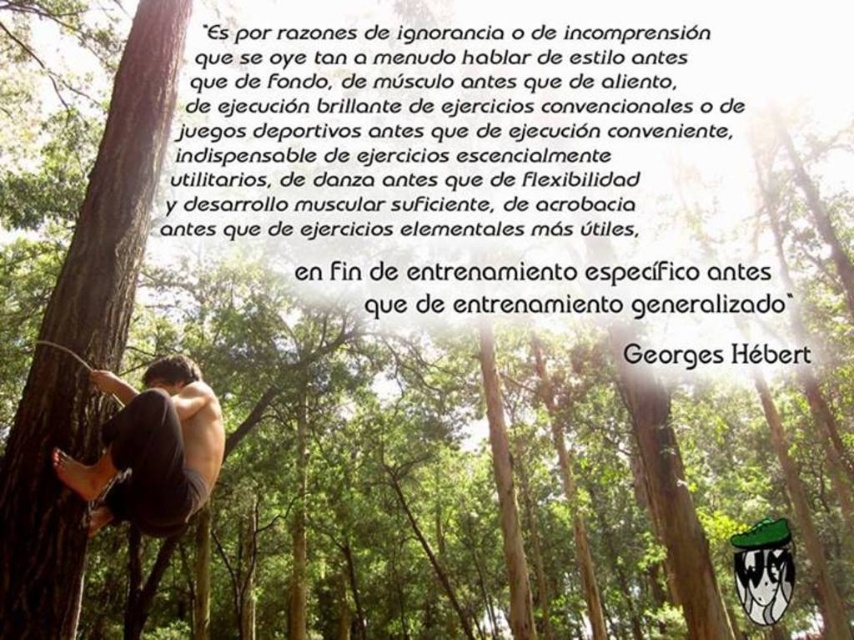
Between brown rough bark tree at left and dark gray fabric pants at lower left, which one is positioned lower?

Positioned lower is dark gray fabric pants at lower left.

Who is positioned more to the left, brown rough bark tree at left or dark gray fabric pants at lower left?

brown rough bark tree at left

Describe the element at coordinates (120, 189) in the screenshot. The height and width of the screenshot is (640, 854). I see `brown rough bark tree at left` at that location.

This screenshot has height=640, width=854. Find the location of `brown rough bark tree at left`. brown rough bark tree at left is located at coordinates (120, 189).